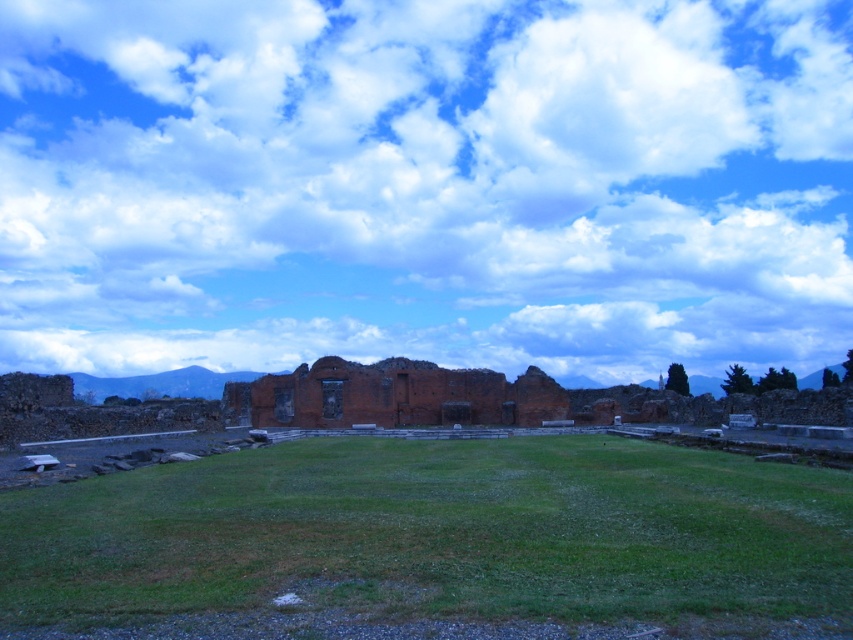
Question: Is white fluffy cloud at upper center smaller than brick wall at center?

Choices:
 (A) no
 (B) yes

Answer: (A)

Question: Does white fluffy cloud at upper center have a smaller size compared to green grassy field at center?

Choices:
 (A) no
 (B) yes

Answer: (A)

Question: Among these points, which one is nearest to the camera?

Choices:
 (A) (323, 410)
 (B) (732, 586)

Answer: (B)

Question: Which point is farther to the camera?

Choices:
 (A) [x=643, y=301]
 (B) [x=450, y=412]
 (C) [x=616, y=536]

Answer: (A)

Question: Which point is farther to the camera?

Choices:
 (A) (248, 406)
 (B) (752, 579)
 (C) (79, 83)

Answer: (C)

Question: Can you confirm if white fluffy cloud at upper center is bigger than brick wall at center?

Choices:
 (A) no
 (B) yes

Answer: (B)